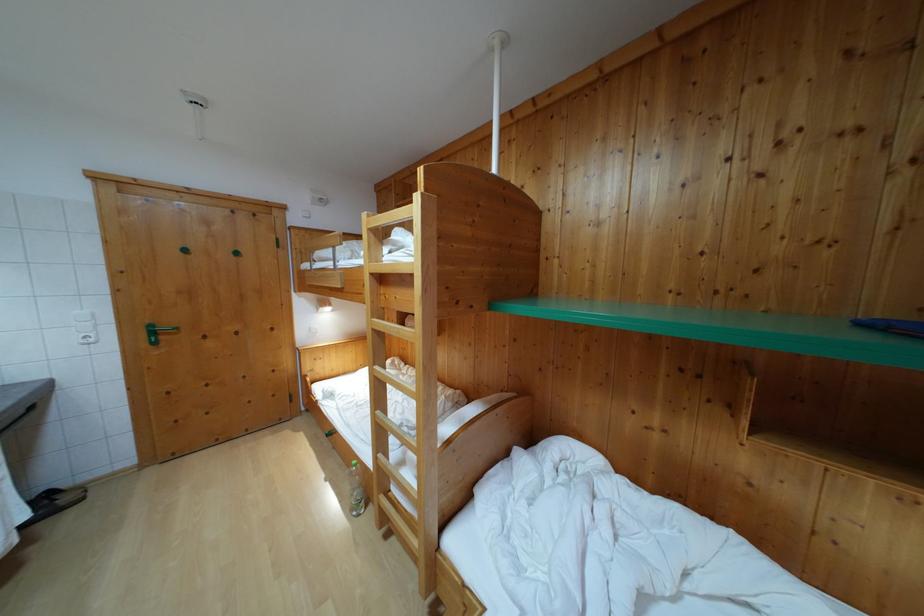
Describe the element at coordinates (391, 219) in the screenshot. I see `the wooden ladder rung` at that location.